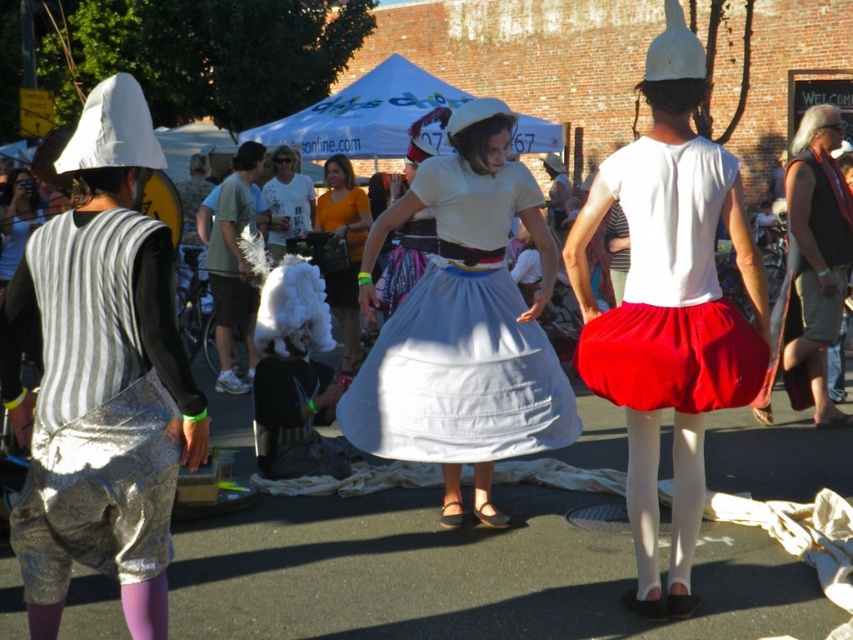
Based on the photo, you are a photographer at the event and want to capture both the shiny silver shorts at left and the matte red skirt at center in your photo. Which one will appear larger in the photo?

The shiny silver shorts at left will appear larger in the photo because it is closer to the viewer than the matte red skirt at center.

Based on the photo, you are a photographer trying to capture the shiny silver shorts at left and the matte red skirt at center in the same frame. Which object should you focus on first if you want to ensure both are in focus without moving the camera?

You should focus on the shiny silver shorts at left first because it is positioned under the matte red skirt at center, meaning it is closer to the camera. By focusing on the closer object, both will be in focus due to the depth of field.